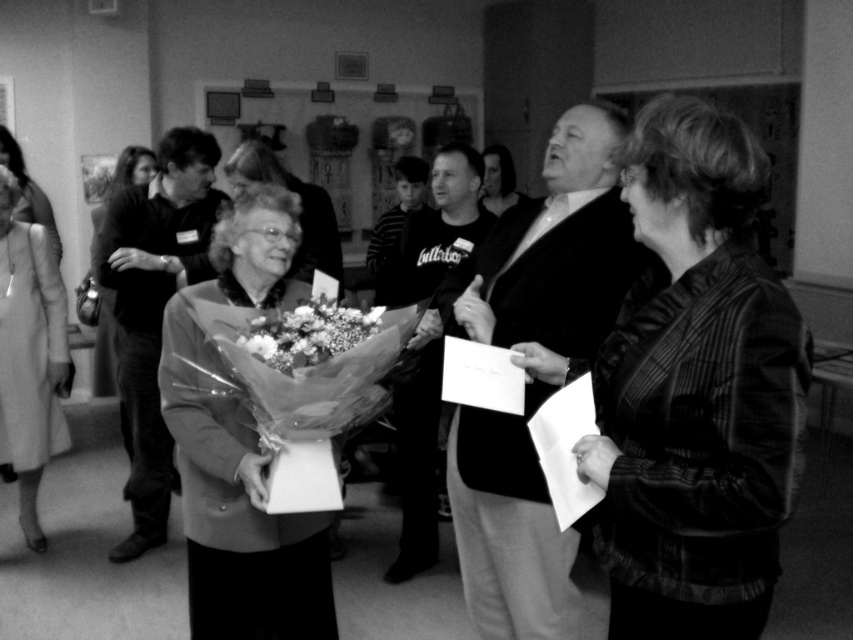
Consider the image. Is smooth black jacket at center positioned behind smooth black shirt at center?

No, it is not.

Does smooth black jacket at center appear under smooth black shirt at center?

Correct, smooth black jacket at center is located below smooth black shirt at center.

You are a GUI agent. You are given a task and a screenshot of the screen. Output one action in this format:
    pyautogui.click(x=<x>, y=<y>)
    Task: Click on the smooth black jacket at center
    
    Given the screenshot: What is the action you would take?
    pyautogui.click(x=555, y=248)

The image size is (853, 640). Identify the location of smooth black jacket at center. (555, 248).

Is smooth black shirt at center behind fluffy paper bouquet at center?

Yes, it is.

Who is lower down, smooth black shirt at center or fluffy paper bouquet at center?

smooth black shirt at center

I want to click on smooth black shirt at center, so click(x=154, y=308).

Is striped fabric jacket at center shorter than matte gray blazer at center?

Indeed, striped fabric jacket at center has a lesser height compared to matte gray blazer at center.

Is striped fabric jacket at center to the right of matte gray blazer at center from the viewer's perspective?

Correct, you'll find striped fabric jacket at center to the right of matte gray blazer at center.

Find the location of a particular element. The width and height of the screenshot is (853, 640). striped fabric jacket at center is located at coordinates (695, 388).